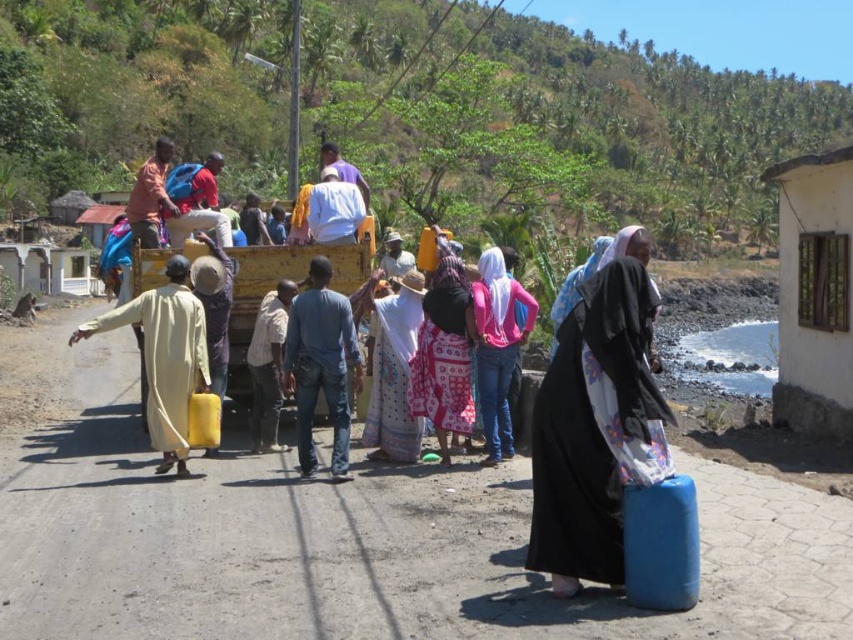
Is point (537, 500) in front of point (283, 276)?

Yes, point (537, 500) is closer to viewer.

Between point (635, 420) and point (144, 264), which one is positioned behind?

The point (144, 264) is behind.

Where is `blue fabric bag at lower right`? blue fabric bag at lower right is located at coordinates (596, 420).

Identify the location of blue fabric bag at lower right. (596, 420).

Which is behind, point (645, 449) or point (410, 456)?

The point (410, 456) is behind.

Between point (595, 529) and point (392, 316), which one is positioned in front?

Point (595, 529) is in front.

Is point (561, 500) positioned behind point (416, 449)?

No, it is in front of (416, 449).

Image resolution: width=853 pixels, height=640 pixels. In order to click on blue fabric bag at lower right in this screenshot , I will do `click(596, 420)`.

Does blue fabric bag at lower right appear under pink fabric dress at center?

Correct, blue fabric bag at lower right is located below pink fabric dress at center.

Find the location of a particular element. blue fabric bag at lower right is located at coordinates (596, 420).

The image size is (853, 640). Identify the location of blue fabric bag at lower right. (596, 420).